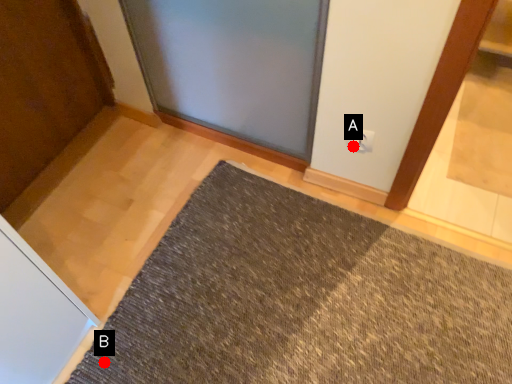
Question: Two points are circled on the image, labeled by A and B beside each circle. Which point is farther from the camera taking this photo?

Choices:
 (A) A is further
 (B) B is further

Answer: (A)